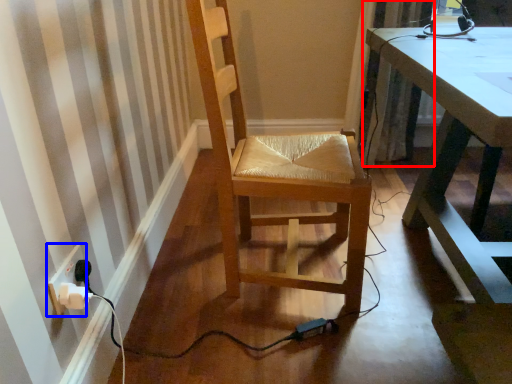
Question: Which point is closer to the camera, curtain (highlighted by a red box) or electric outlet (highlighted by a blue box)?

Choices:
 (A) curtain
 (B) electric outlet

Answer: (B)